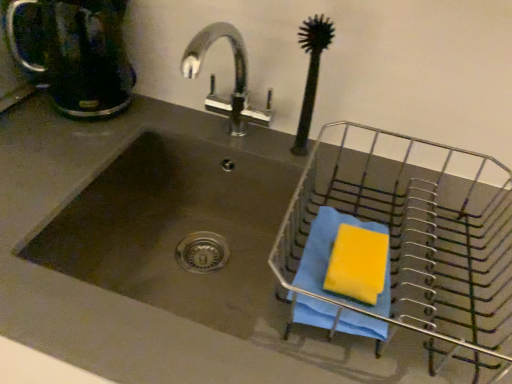
Find the location of a particular element. vacant space in metallic wire basket at right (from a real-world perspective) is located at coordinates (416, 268).